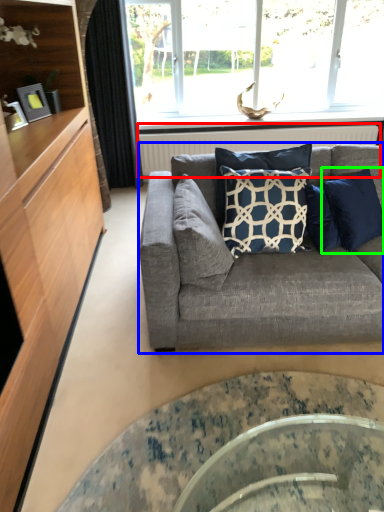
Question: Which is farther away from radiator (highlighted by a red box)? studio couch (highlighted by a blue box) or pillow (highlighted by a green box)?

Choices:
 (A) studio couch
 (B) pillow

Answer: (A)